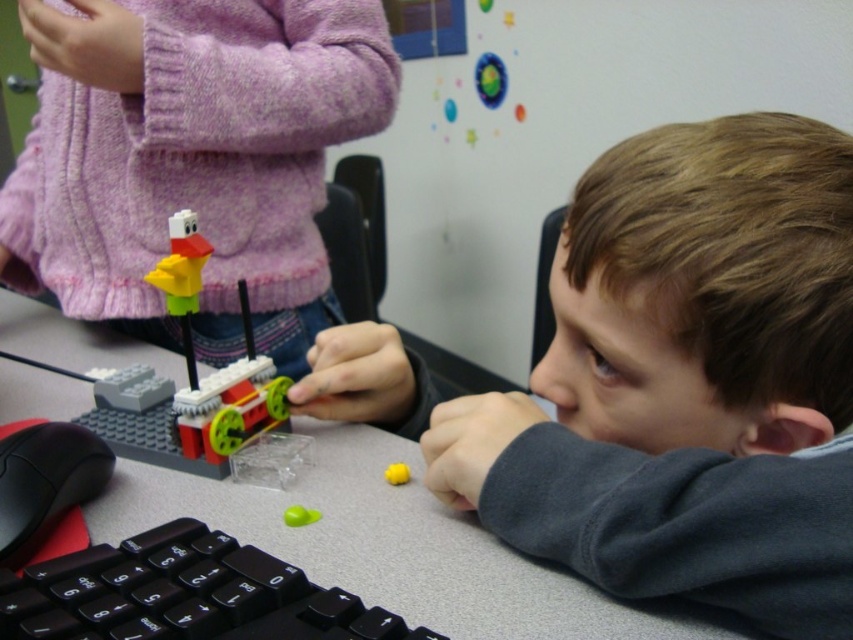
Image resolution: width=853 pixels, height=640 pixels. In order to click on matte plastic toy at center in this screenshot , I will do `click(201, 168)`.

Does matte plastic toy at center have a lesser height compared to yellow matte ball at center?

In fact, matte plastic toy at center may be taller than yellow matte ball at center.

What do you see at coordinates (201, 168) in the screenshot? I see `matte plastic toy at center` at bounding box center [201, 168].

In order to click on matte plastic toy at center in this screenshot , I will do pos(201,168).

The height and width of the screenshot is (640, 853). What do you see at coordinates (189, 380) in the screenshot? I see `brick-like plastic duck at center` at bounding box center [189, 380].

Can you confirm if brick-like plastic duck at center is positioned above yellow matte ball at center?

Correct, brick-like plastic duck at center is located above yellow matte ball at center.

The width and height of the screenshot is (853, 640). What are the coordinates of `brick-like plastic duck at center` in the screenshot? It's located at point(189,380).

Consider the image. Is the position of matte plastic toy at center more distant than that of black plastic keyboard at lower left?

Yes.

Does matte plastic toy at center appear on the left side of black plastic keyboard at lower left?

Indeed, matte plastic toy at center is positioned on the left side of black plastic keyboard at lower left.

This screenshot has width=853, height=640. What do you see at coordinates (201, 168) in the screenshot? I see `matte plastic toy at center` at bounding box center [201, 168].

Locate an element on the screen. The height and width of the screenshot is (640, 853). matte plastic toy at center is located at coordinates (201, 168).